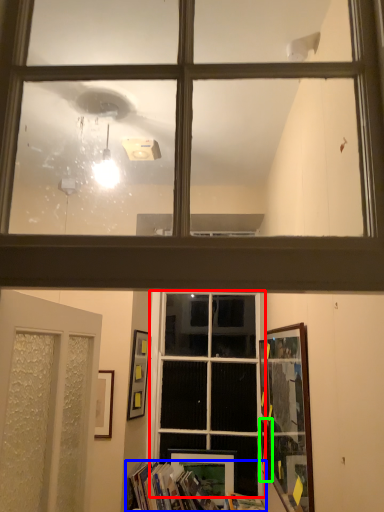
Question: Which object is the closest to the window (highlighted by a red box)? Choose among these: book (highlighted by a blue box) or picture frame (highlighted by a green box).

Choices:
 (A) book
 (B) picture frame

Answer: (A)